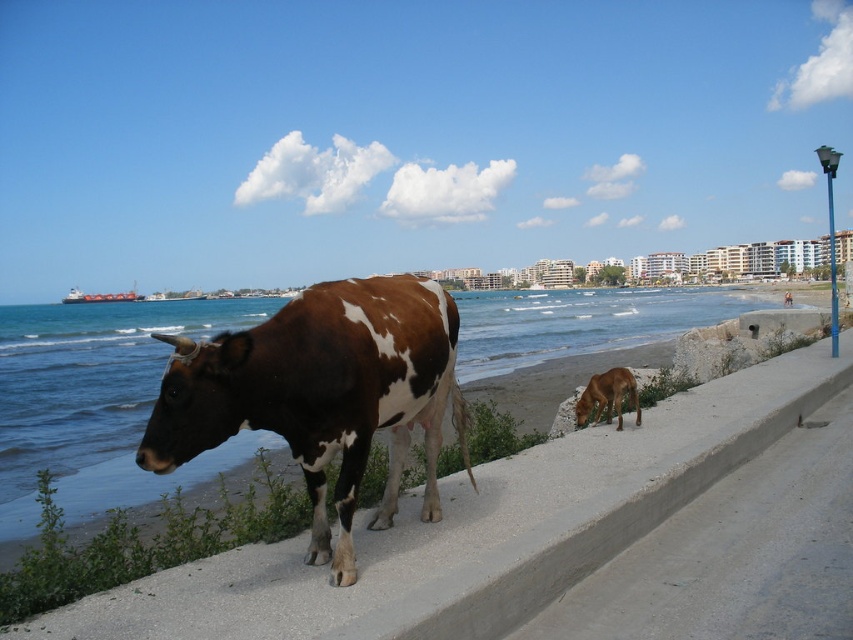
Who is shorter, brown glossy water at center or brown and white speckled cow at center?

With less height is brown and white speckled cow at center.

Who is taller, brown glossy water at center or brown and white speckled cow at center?

With more height is brown glossy water at center.

In order to click on brown glossy water at center in this screenshot , I will do `click(97, 404)`.

This screenshot has width=853, height=640. What are the coordinates of `brown glossy water at center` in the screenshot? It's located at pos(97,404).